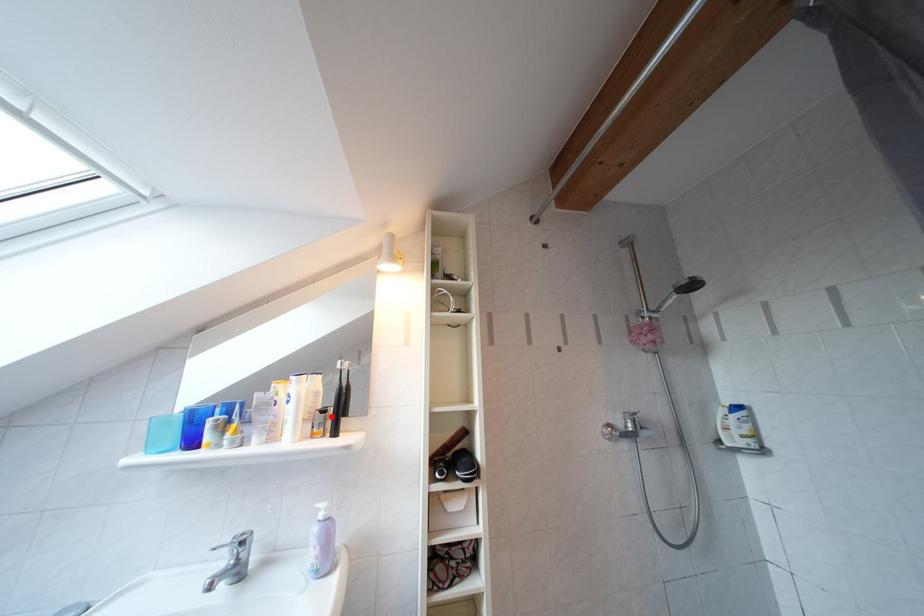
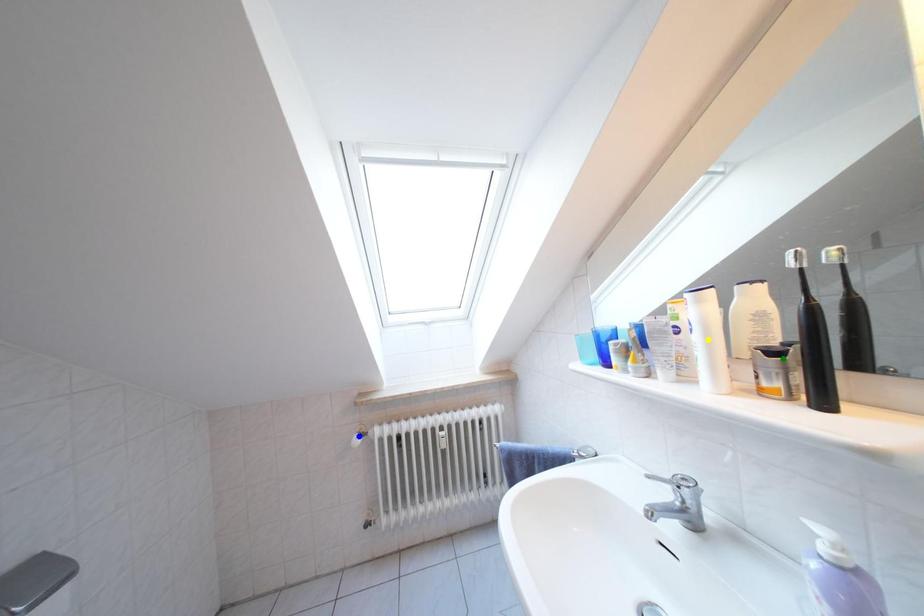
Question: I am providing you with two images of the same scene from different viewpoints. A red point is marked on the first image. You are given multiple points on the second image. Which point in image 2 represents the same 3d spot as the red point in image 1?

Choices:
 (A) green point
 (B) yellow point
 (C) blue point

Answer: (A)